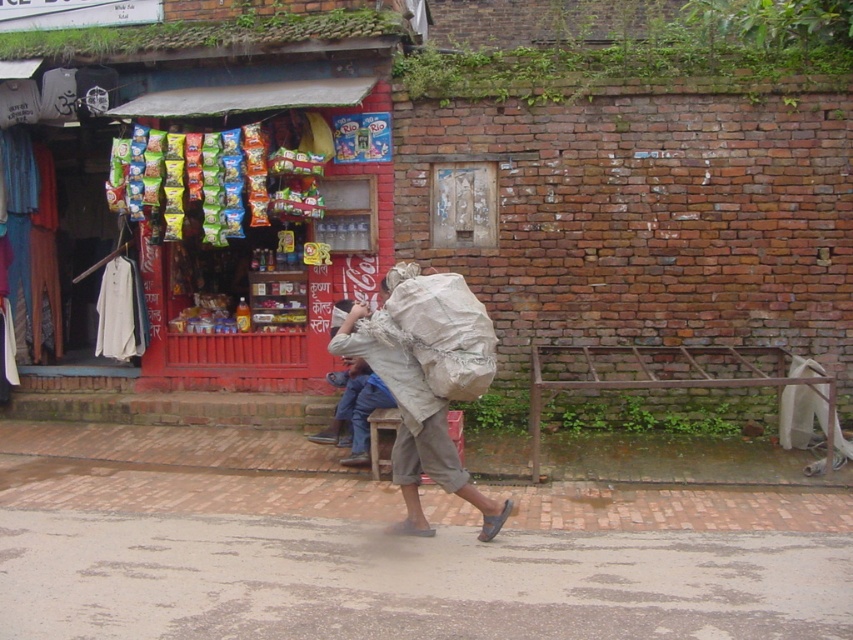
You are a delivery person trying to deliver a package to the red brick wall at upper center. You see the white paper sack at center blocking the path. Can you go around it?

The red brick wall at upper center is positioned over the white paper sack at center, so the sack is directly below the wall. Since the sack is blocking the path to the wall, you would need to navigate around it to reach the wall.

You are a photographer trying to capture the white paper sack at center in your shot. However, there is a red brick wall at upper center in the way. Can you adjust your position so that the sack is no longer blocked by the wall?

The white paper sack at center is behind the red brick wall at upper center, so moving your position might not help since the sack is physically located behind the wall. You might need to move closer or find an angle where the sack is visible around or under the wall.

You are a delivery person who needs to attach a note to either the red brick wall at upper center or the white paper sack at center. Which object is larger and therefore better suited for the note?

The red brick wall at upper center is bigger than the white paper sack at center, so it is better suited for attaching the note.